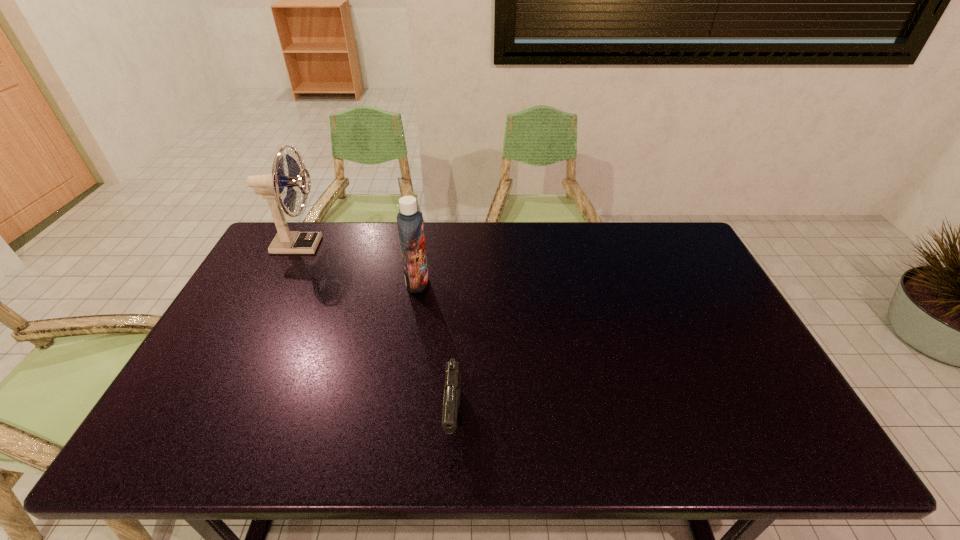
This screenshot has width=960, height=540. In order to click on the farthest object in this screenshot , I will do `click(270, 186)`.

Identify the location of the leftmost object. (270, 186).

I want to click on the second nearest object, so point(409,220).

This screenshot has height=540, width=960. Find the location of `the second shortest object`. the second shortest object is located at coordinates (409, 220).

Where is `pistol`? The image size is (960, 540). pistol is located at coordinates click(452, 394).

Identify the location of the rightmost object. (452, 394).

Where is `blank space located on the front-facing side of the tallest object`? blank space located on the front-facing side of the tallest object is located at coordinates pos(398,245).

Where is `vacant space situated 0.280m on the front label of the second tallest object`? This screenshot has width=960, height=540. vacant space situated 0.280m on the front label of the second tallest object is located at coordinates (517, 282).

Where is `object located at the far edge`? The image size is (960, 540). object located at the far edge is located at coordinates (270, 186).

Where is `object located in the near edge section of the desktop`? This screenshot has height=540, width=960. object located in the near edge section of the desktop is located at coordinates pyautogui.click(x=452, y=394).